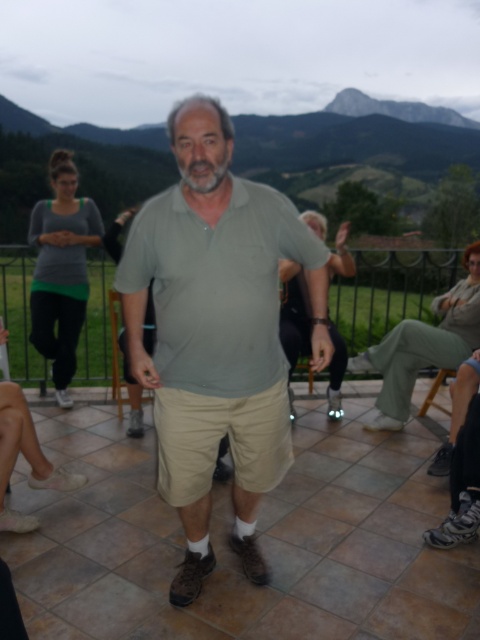
Does matte green shirt at center appear over rocky gray mountain at upper center?

No, matte green shirt at center is not above rocky gray mountain at upper center.

Does matte green shirt at center have a larger size compared to rocky gray mountain at upper center?

No, matte green shirt at center is not bigger than rocky gray mountain at upper center.

Where is `matte green shirt at center`? This screenshot has height=640, width=480. matte green shirt at center is located at coordinates (216, 332).

Consider the image. Can you confirm if rocky gray mountain at upper center is shorter than khaki pants at lower right?

No, rocky gray mountain at upper center is not shorter than khaki pants at lower right.

Can you confirm if rocky gray mountain at upper center is positioned below khaki pants at lower right?

No.

Is point (60, 134) farther from viewer compared to point (439, 353)?

Yes, point (60, 134) is farther from viewer.

The image size is (480, 640). What are the coordinates of `rocky gray mountain at upper center` in the screenshot? It's located at (356, 157).

How much distance is there between matte green shirt at center and khaki pants at lower right?

They are 2.32 meters apart.

Who is higher up, matte green shirt at center or khaki pants at lower right?

khaki pants at lower right is higher up.

Identify the location of matte green shirt at center. This screenshot has height=640, width=480. (216, 332).

Locate an element on the screen. matte green shirt at center is located at coordinates tap(216, 332).